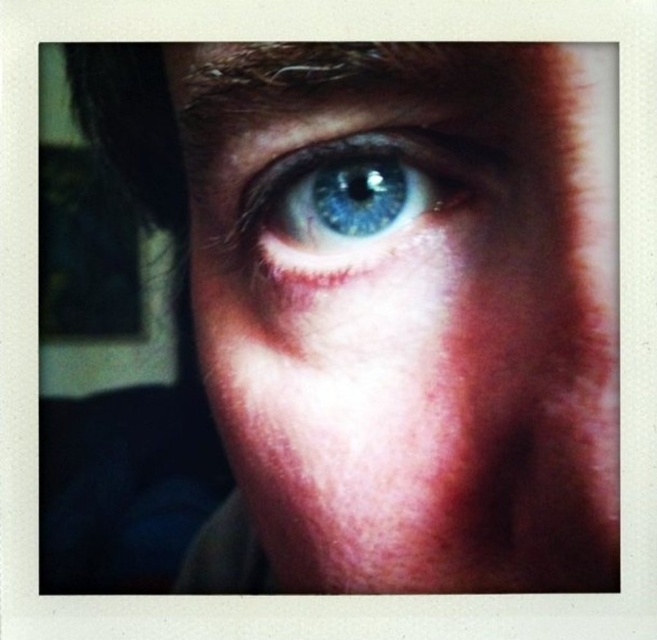
You are a photographer analyzing the composition of this portrait. The image has a point marked at coordinates (401, 310). Based on the scene description, what object is located at this point?

The point at coordinates (401, 310) indicates the blue matte eye at center.

You are a photographer trying to capture a closeup of an eye. You have two eyes in your viewfinder, the blue matte eye at center and the blue glossy eye at upper center. The camera you are using has a focus range of 5 centimeters. Can you focus on both eyes at the same time?

The blue matte eye at center and blue glossy eye at upper center are 5.73 centimeters apart from each other. Since the camera has a focus range of 5 centimeters, it cannot focus on both eyes simultaneously because the distance between them exceeds the focus range.

You are a photographer adjusting the camera settings to capture a detailed closeup of the blue matte eye at center and the blue glossy eye at upper center. Which eye should you focus on if you want to ensure the wider one is in sharp focus?

The blue matte eye at center is wider than the blue glossy eye at upper center, so you should focus on the blue matte eye at center to ensure the wider one is in sharp focus.